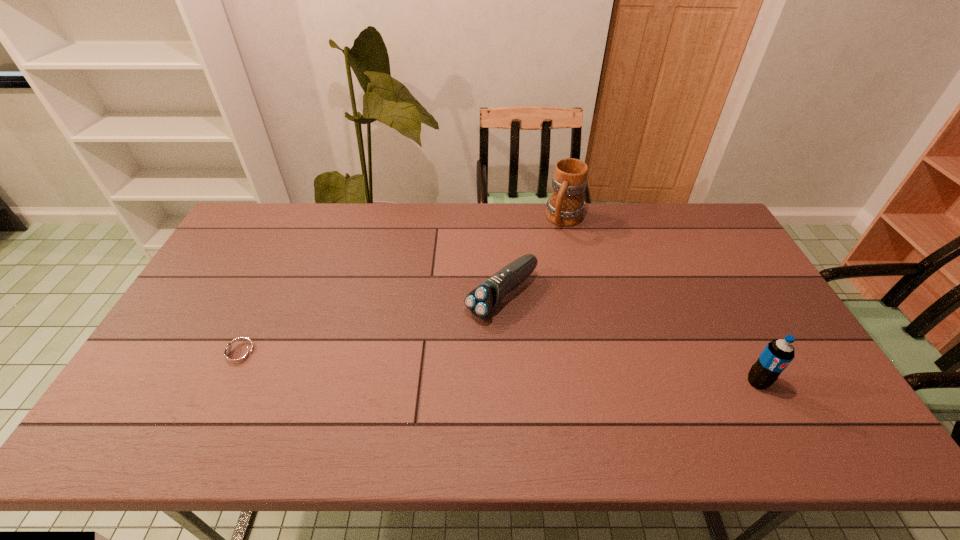
This screenshot has width=960, height=540. In order to click on object that is positioned at the right edge in this screenshot , I will do `click(777, 355)`.

Identify the location of object situated at the near left corner. (239, 354).

At what (x,y) coordinates should I click in order to perform the action: click on object that is positioned at the near right corner. Please return your answer as a coordinate pair (x, y). Looking at the image, I should click on (777, 355).

You are a GUI agent. You are given a task and a screenshot of the screen. Output one action in this format:
    pyautogui.click(x=<x>, y=<y>)
    Task: Click on the free point at the far edge
    
    Given the screenshot: What is the action you would take?
    pyautogui.click(x=334, y=220)

In the image, there is a desktop. Where is `vacant space at the near edge`? The height and width of the screenshot is (540, 960). vacant space at the near edge is located at coordinates (473, 384).

What are the coordinates of `free space at the left edge` in the screenshot? It's located at (228, 269).

This screenshot has width=960, height=540. Identify the location of free space at the right edge of the desktop. (756, 320).

Find the location of `free location at the near left corner`. free location at the near left corner is located at coordinates (165, 393).

I want to click on free space at the far right corner of the desktop, so click(708, 237).

Identify the location of blank region between the watch and the third shortest object. Image resolution: width=960 pixels, height=540 pixels. (498, 368).